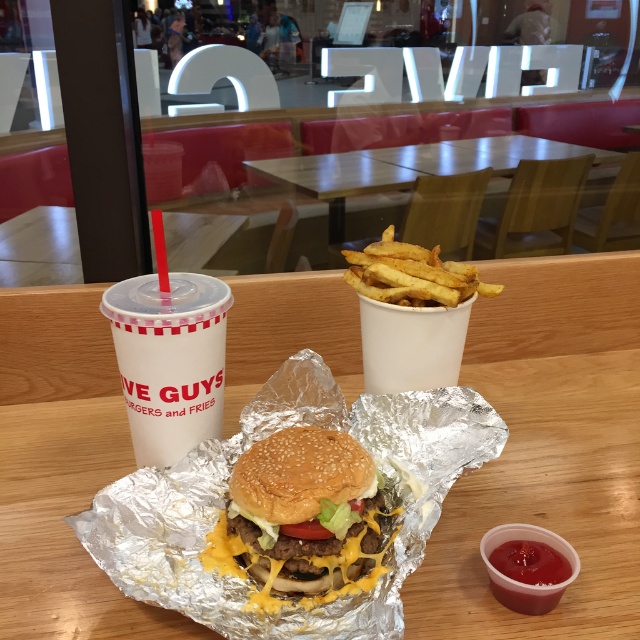
Question: Can you confirm if wooden table at center is positioned to the left of white plastic cup at center?

Choices:
 (A) yes
 (B) no

Answer: (B)

Question: Can you confirm if white paper cup at center is thinner than smooth plastic cup at lower right?

Choices:
 (A) no
 (B) yes

Answer: (A)

Question: Is wooden table at center below golden brown bun at center?

Choices:
 (A) yes
 (B) no

Answer: (B)

Question: Which object appears farthest from the camera in this image?

Choices:
 (A) golden crispy fries at center
 (B) white plastic cup at center
 (C) smooth plastic cup at lower right
 (D) wooden table at center

Answer: (A)

Question: Which object appears farthest from the camera in this image?

Choices:
 (A) golden crispy fries at center
 (B) wooden table at center
 (C) golden brown bun at center
 (D) smooth plastic cup at lower right

Answer: (A)

Question: Estimate the real-world distances between objects in this image. Which object is farther from the white plastic cup at center?

Choices:
 (A) golden crispy fries at center
 (B) wooden table at center

Answer: (B)